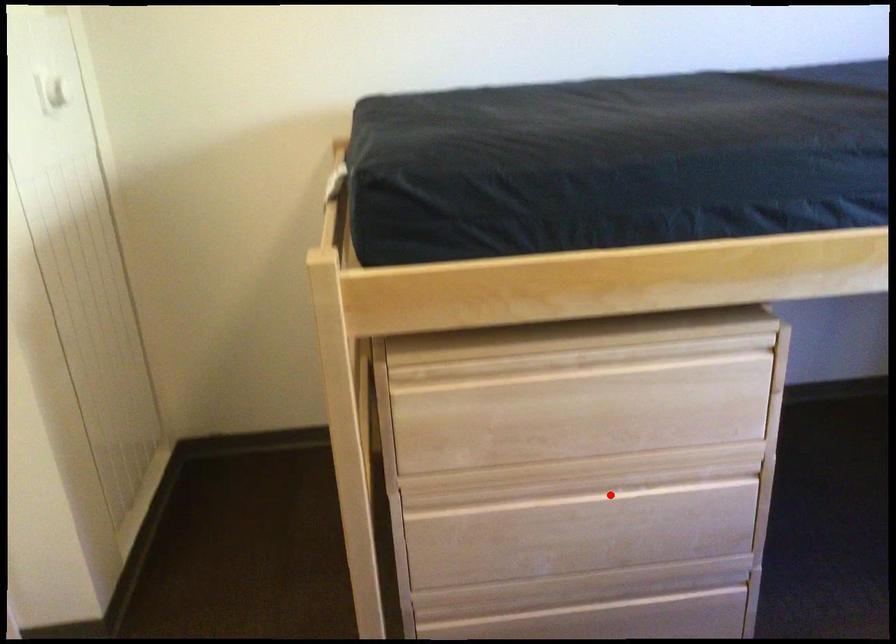
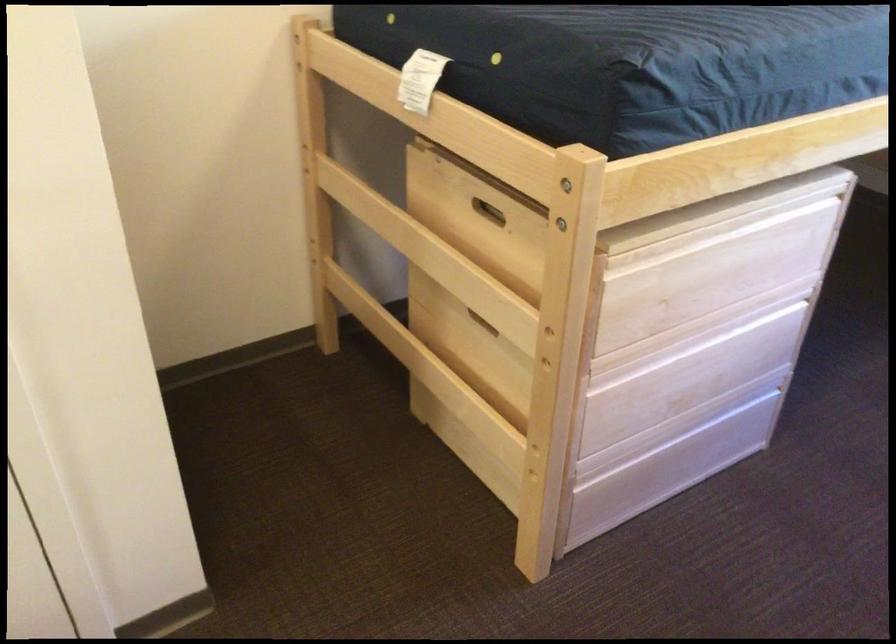
Question: I am providing you with two images of the same scene from different viewpoints. In image1, a red point is highlighted. Considering the same 3D point in image2, which of the following is correct?

Choices:
 (A) It is closer
 (B) It is farther

Answer: (B)